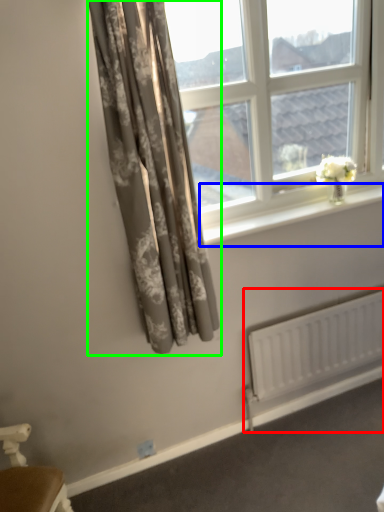
Question: Estimate the real-world distances between objects in this image. Which object is farther from radiator (highlighted by a red box), window sill (highlighted by a blue box) or curtain (highlighted by a green box)?

Choices:
 (A) window sill
 (B) curtain

Answer: (B)